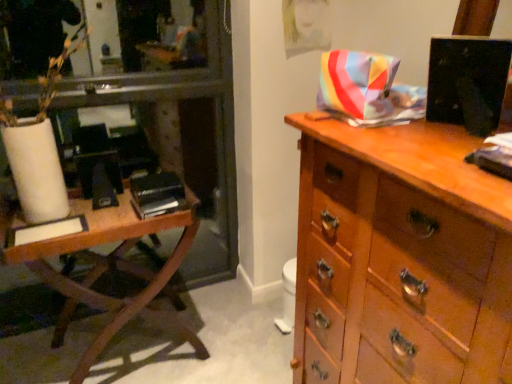
At what (x,y) coordinates should I click in order to perform the action: click on free point below wooden table at left (from a real-world perspective). Please return your answer as a coordinate pair (x, y). This screenshot has height=384, width=512. Looking at the image, I should click on (124, 354).